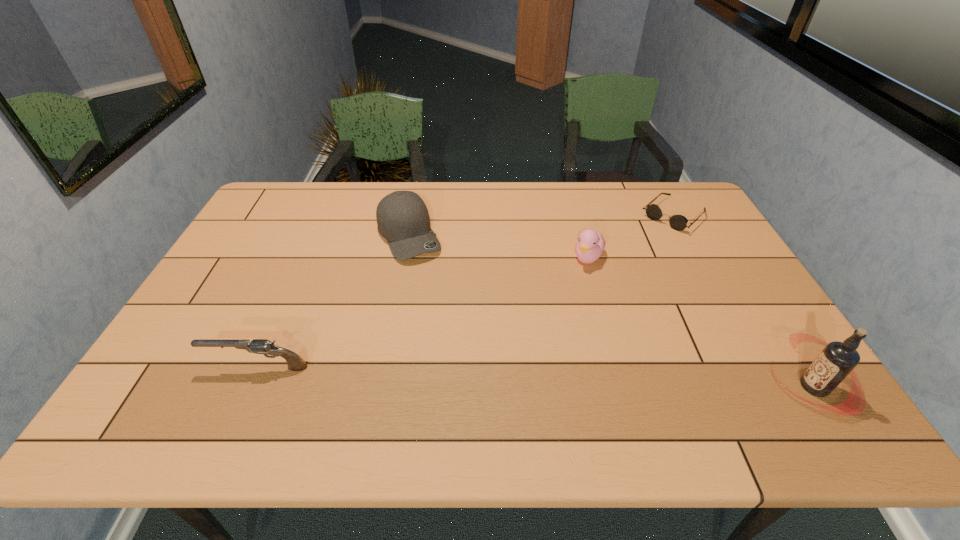
Locate an element on the screen. This screenshot has width=960, height=540. vacant space on the desktop that is between the gun and the tallest object and is positioned on the front-facing side of the duckling is located at coordinates (531, 377).

Locate an element on the screen. vacant spot on the desktop that is between the leftmost object and the root beer and is positioned on the front brim of the second object from left to right is located at coordinates (494, 375).

Identify the location of free space on the desktop that is between the gun and the tallest object and is positioned on the front-facing side of the shortest object. The width and height of the screenshot is (960, 540). (502, 376).